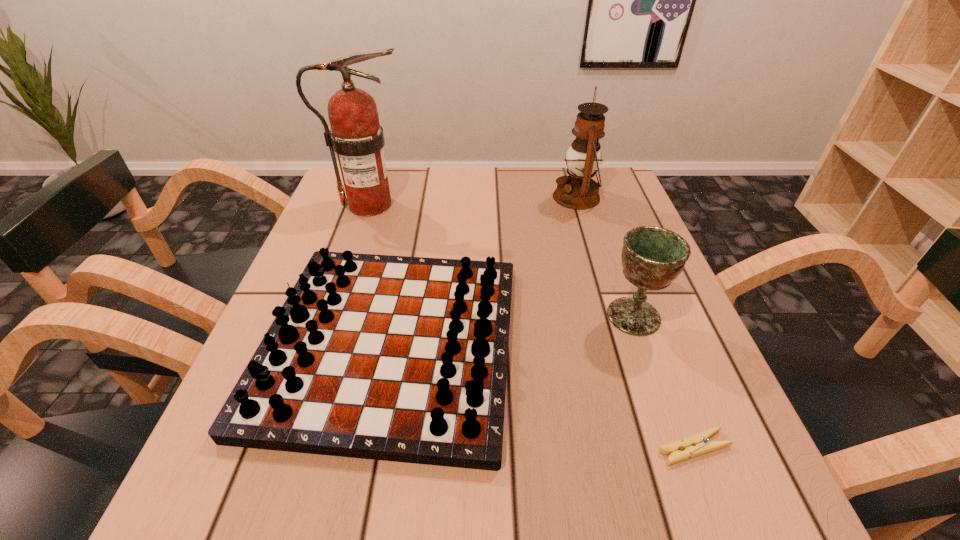
Where is `clothespin that is at the right edge`? clothespin that is at the right edge is located at coordinates (698, 444).

Find the location of a particular element. The width and height of the screenshot is (960, 540). object present at the far left corner is located at coordinates (356, 136).

This screenshot has height=540, width=960. Find the location of `object that is at the near left corner`. object that is at the near left corner is located at coordinates (395, 358).

The width and height of the screenshot is (960, 540). Identify the location of object that is at the far right corner. (578, 191).

Identify the location of object at the near right corner. (698, 444).

Locate an element on the screen. This screenshot has height=540, width=960. vacant area at the far edge of the desktop is located at coordinates (406, 211).

The width and height of the screenshot is (960, 540). I want to click on free region at the near edge, so click(x=382, y=468).

This screenshot has width=960, height=540. What are the coordinates of `blank space at the right edge` in the screenshot? It's located at (718, 409).

Identify the location of vacant area at the near left corner. This screenshot has height=540, width=960. (257, 489).

Image resolution: width=960 pixels, height=540 pixels. In the image, there is a desktop. Identify the location of vacant space at the far right corner. (617, 168).